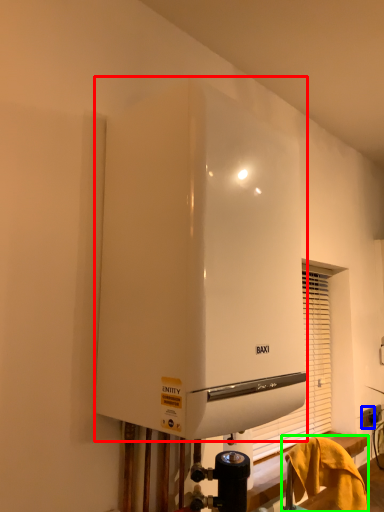
Question: Considering the real-world distances, which object is closest to home appliance (highlighted by a red box)? electric outlet (highlighted by a blue box) or furniture (highlighted by a green box).

Choices:
 (A) electric outlet
 (B) furniture

Answer: (B)